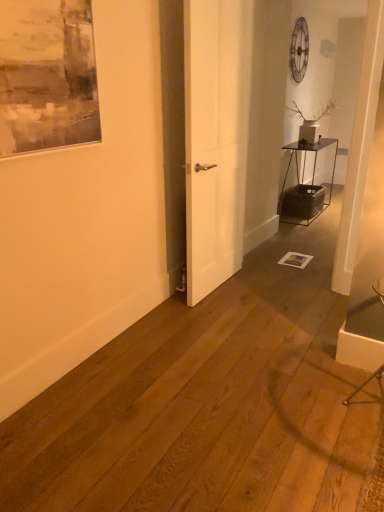
This screenshot has height=512, width=384. What are the coordinates of `vacant location below matte gray painting at upper left (from a real-world perspective)` in the screenshot? It's located at (74, 324).